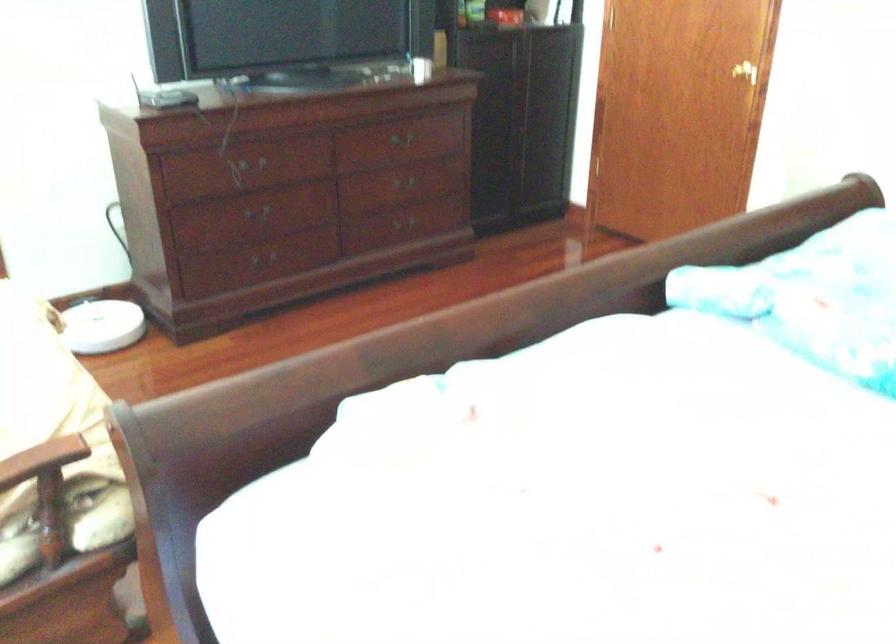
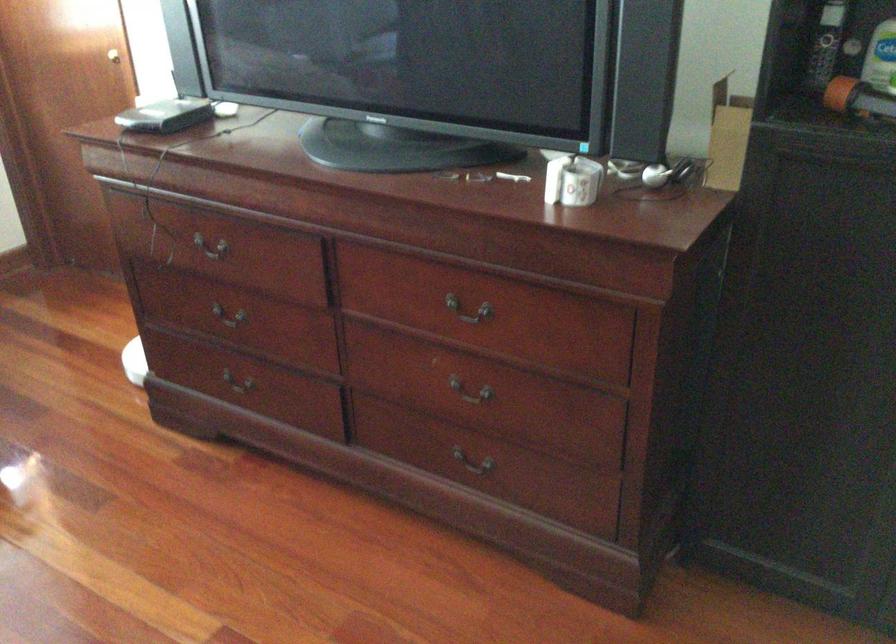
The point at (386, 185) is marked in the first image. Where is the corresponding point in the second image?

(470, 392)